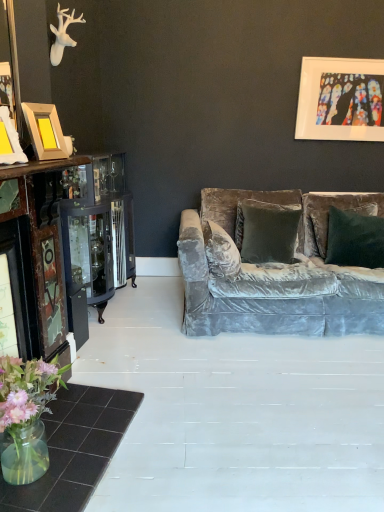
Question: Does point (334, 108) appear closer or farther from the camera than point (331, 219)?

Choices:
 (A) closer
 (B) farther

Answer: (B)

Question: Would you say stained glass artwork at upper right, which is the first picture frame in back-to-front order, is to the left or to the right of velvet green pillow at center in the picture?

Choices:
 (A) right
 (B) left

Answer: (A)

Question: Considering the real-world distances, which object is farthest from the velvet green pillow at center?

Choices:
 (A) wooden photo frame at left, which is the first picture frame in left-to-right order
 (B) translucent glass vase at lower left
 (C) translucent glass vase at lower left
 (D) stained glass artwork at upper right, the 2th picture frame in the front-to-back sequence

Answer: (C)

Question: Estimate the real-world distances between objects in this image. Which object is closer to the translucent glass vase at lower left?

Choices:
 (A) stained glass artwork at upper right, positioned as the first picture frame in top-to-bottom order
 (B) wooden photo frame at left, which is the first picture frame in left-to-right order
 (C) velvet green pillow at center
 (D) translucent glass vase at lower left

Answer: (D)